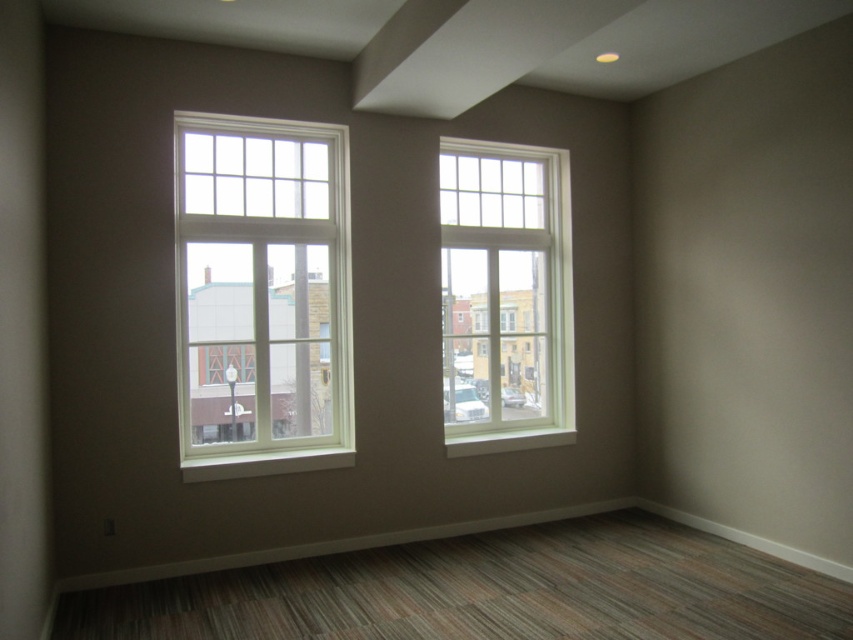
Does white wood window at left have a greater width compared to white wood window at center?

Yes, white wood window at left is wider than white wood window at center.

Can you confirm if white wood window at left is taller than white wood window at center?

Yes, white wood window at left is taller than white wood window at center.

Is point (189, 416) in front of point (517, 221)?

That is True.

In order to click on white wood window at left in this screenshot , I will do `click(262, 296)`.